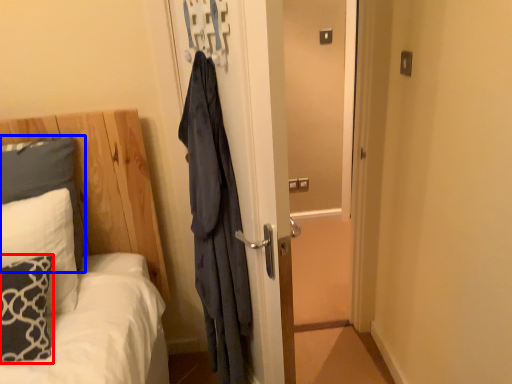
Question: Which object appears farthest to the camera in this image, pillow (highlighted by a red box) or pillow (highlighted by a blue box)?

Choices:
 (A) pillow
 (B) pillow

Answer: (B)